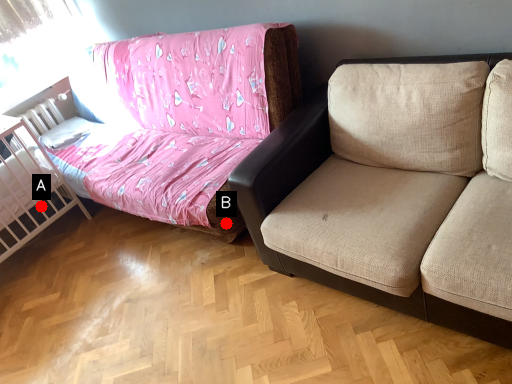
Question: Two points are circled on the image, labeled by A and B beside each circle. Which point appears closest to the camera in this image?

Choices:
 (A) A is closer
 (B) B is closer

Answer: (B)